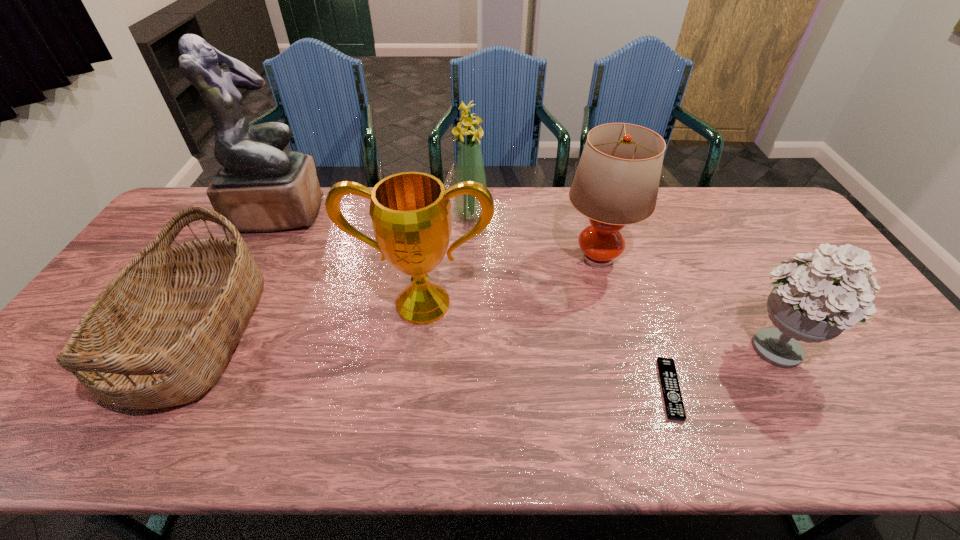
Where is `free space between the award and the shorter bouquet`? Image resolution: width=960 pixels, height=540 pixels. free space between the award and the shorter bouquet is located at coordinates (600, 325).

Find the location of a particular element. The width and height of the screenshot is (960, 540). free point between the remote control and the right bouquet is located at coordinates (723, 367).

The width and height of the screenshot is (960, 540). Find the location of `free space between the award and the rightmost object`. free space between the award and the rightmost object is located at coordinates (600, 325).

In order to click on object that stands as the third closest to the farther bouquet in this screenshot , I will do `click(259, 188)`.

Identify which object is located as the fifth nearest to the lamp. Please provide its 2D coordinates. Your answer should be formatted as a tuple, i.e. [(x, y)], where the tuple contains the x and y coordinates of a point satisfying the conditions above.

[(259, 188)]

Identify the location of vacant space that satisfies the following two spatial constraints: 1. in a relaxed pose on the shortest object; 2. on the left side of the tallest object. Image resolution: width=960 pixels, height=540 pixels. (185, 389).

Locate an element on the screen. vacant region that satisfies the following two spatial constraints: 1. on the front-facing side of the farther bouquet; 2. on the back side of the third shortest object is located at coordinates (468, 346).

Identify the location of vacant region that satisfies the following two spatial constraints: 1. in a relaxed pose on the sculpture; 2. on the front side of the basket. This screenshot has height=540, width=960. (214, 334).

Identify the location of vacant region that satisfies the following two spatial constraints: 1. on the front-facing side of the rightmost object; 2. on the left side of the award. (419, 346).

You are a GUI agent. You are given a task and a screenshot of the screen. Output one action in this format:
    pyautogui.click(x=<x>, y=<y>)
    Task: Click on the vacant region that satisfies the following two spatial constraints: 1. on the front-facing side of the farther bouquet; 2. on the front side of the basket
    This screenshot has width=960, height=540.
    Given the screenshot: What is the action you would take?
    pyautogui.click(x=468, y=334)